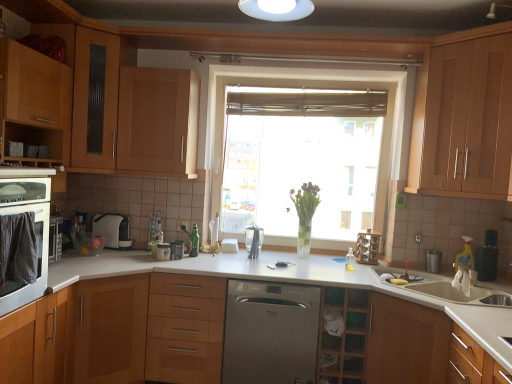
Locate an element on the screen. Image resolution: width=512 pixels, height=384 pixels. free spot to the right of metallic silver toaster at center, the 2th appliance in the left-to-right sequence is located at coordinates (201, 261).